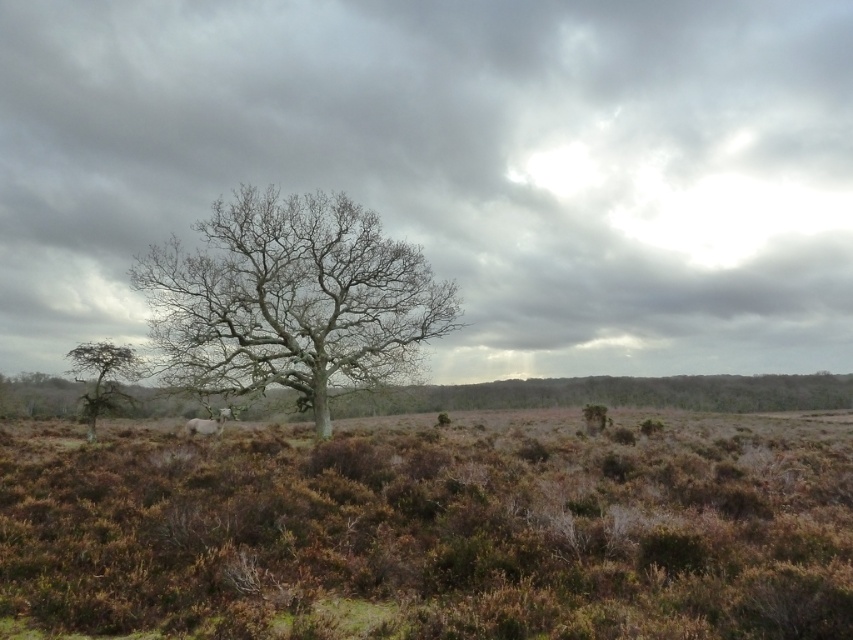
Question: Does gray cloudy sky at center appear under green matte tree at lower left?

Choices:
 (A) yes
 (B) no

Answer: (B)

Question: Which object is farther from the camera taking this photo?

Choices:
 (A) gray cloudy sky at center
 (B) green matte tree at lower left

Answer: (B)

Question: Does bare wood tree at center appear under white woolly sheep at center?

Choices:
 (A) no
 (B) yes

Answer: (A)

Question: Does gray cloudy sky at center appear on the left side of bare wood tree at center?

Choices:
 (A) no
 (B) yes

Answer: (A)

Question: Which of the following is the closest to the observer?

Choices:
 (A) (144, 284)
 (B) (229, 161)

Answer: (A)

Question: Which point is closer to the camera?

Choices:
 (A) bare wood tree at center
 (B) gray cloudy sky at center
 (C) green matte tree at lower left

Answer: (A)